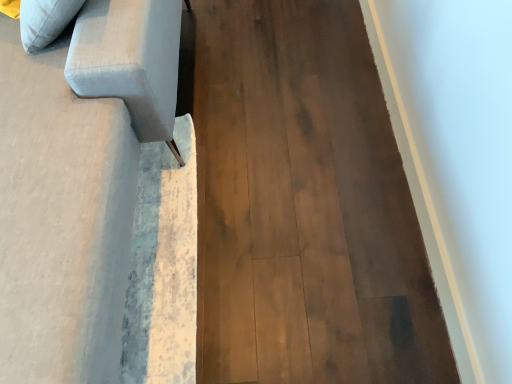
Question: Should I look upward or downward to see light gray fabric couch at left?

Choices:
 (A) down
 (B) up

Answer: (B)

Question: Considering the relative sizes of light gray fabric couch at left and brown wood floor at center in the image provided, is light gray fabric couch at left shorter than brown wood floor at center?

Choices:
 (A) yes
 (B) no

Answer: (B)

Question: Is light gray fabric couch at left further to camera compared to brown wood floor at center?

Choices:
 (A) no
 (B) yes

Answer: (A)

Question: Considering the relative sizes of light gray fabric couch at left and brown wood floor at center in the image provided, is light gray fabric couch at left taller than brown wood floor at center?

Choices:
 (A) yes
 (B) no

Answer: (A)

Question: Is light gray fabric couch at left in front of brown wood floor at center?

Choices:
 (A) yes
 (B) no

Answer: (A)

Question: Does light gray fabric couch at left have a greater width compared to brown wood floor at center?

Choices:
 (A) yes
 (B) no

Answer: (A)

Question: Considering the relative sizes of light gray fabric couch at left and brown wood floor at center in the image provided, is light gray fabric couch at left smaller than brown wood floor at center?

Choices:
 (A) no
 (B) yes

Answer: (A)

Question: Can you confirm if brown wood floor at center is shorter than light gray fabric couch at left?

Choices:
 (A) no
 (B) yes

Answer: (B)

Question: Does brown wood floor at center come in front of light gray fabric couch at left?

Choices:
 (A) no
 (B) yes

Answer: (A)

Question: Is brown wood floor at center turned away from light gray fabric couch at left?

Choices:
 (A) no
 (B) yes

Answer: (A)

Question: Is brown wood floor at center outside of light gray fabric couch at left?

Choices:
 (A) yes
 (B) no

Answer: (A)

Question: Can you confirm if brown wood floor at center is positioned to the left of light gray fabric couch at left?

Choices:
 (A) yes
 (B) no

Answer: (B)

Question: Is brown wood floor at center positioned far away from light gray fabric couch at left?

Choices:
 (A) no
 (B) yes

Answer: (A)

Question: From a real-world perspective, is light gray fabric couch at left physically located above or below brown wood floor at center?

Choices:
 (A) above
 (B) below

Answer: (A)